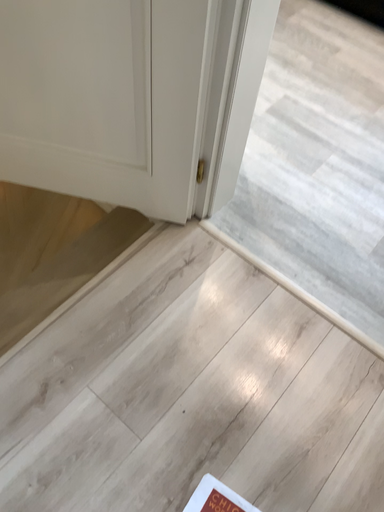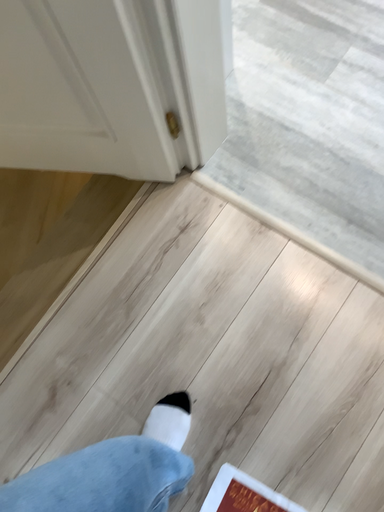
Question: Which way did the camera rotate in the video?

Choices:
 (A) rotated left
 (B) rotated right

Answer: (A)